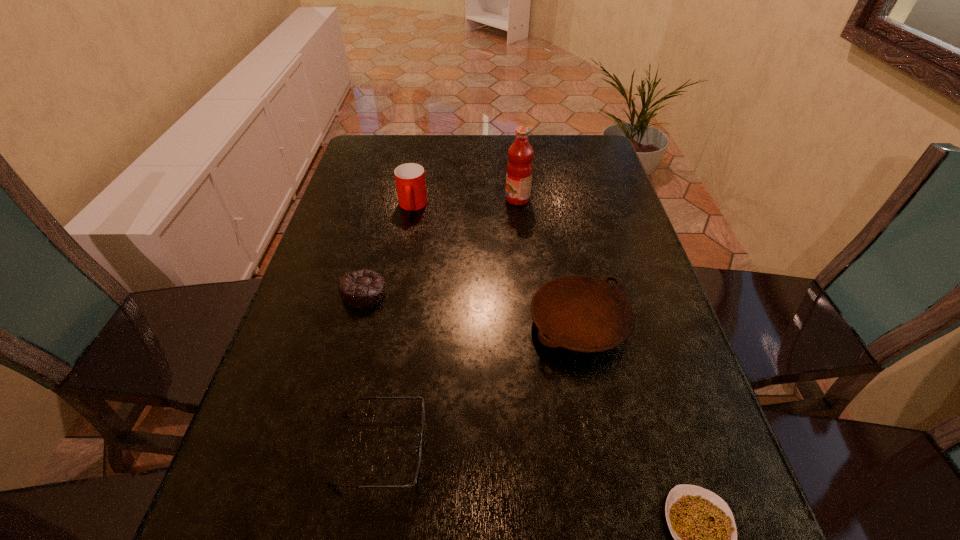
Find the location of a particular element. vacant space located 0.200m on the front of the beanbag is located at coordinates (340, 388).

The image size is (960, 540). I want to click on vacant space situated 0.050m on the front-facing side of the spectacles, so click(454, 448).

You are a GUI agent. You are given a task and a screenshot of the screen. Output one action in this format:
    pyautogui.click(x=<x>, y=<y>)
    Task: Click on the object that is at the left edge
    
    Given the screenshot: What is the action you would take?
    pyautogui.click(x=362, y=288)

You are a GUI agent. You are given a task and a screenshot of the screen. Output one action in this format:
    pyautogui.click(x=<x>, y=<y>)
    Task: Click on the object that is positioned at the right edge
    The image size is (960, 540).
    Given the screenshot: What is the action you would take?
    pyautogui.click(x=580, y=313)

The width and height of the screenshot is (960, 540). I want to click on vacant area at the far edge of the desktop, so tap(533, 140).

The height and width of the screenshot is (540, 960). I want to click on vacant space at the left edge, so click(x=296, y=397).

The height and width of the screenshot is (540, 960). In the image, there is a desktop. Find the location of `vacant space at the right edge`. vacant space at the right edge is located at coordinates (618, 245).

Locate an element on the screen. vacant space at the far right corner of the desktop is located at coordinates tap(570, 170).

Identify the location of vacant space in between the spectacles and the beanbag. The height and width of the screenshot is (540, 960). (372, 370).

Identify the location of vacant point located between the plate and the spectacles. Image resolution: width=960 pixels, height=540 pixels. (479, 386).